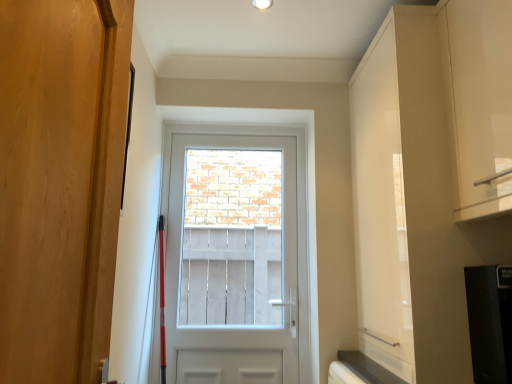
Question: Does wooden door at left, positioned as the 1th door in front-to-back order, have a lesser height compared to white glossy door at center, the first door from the back?

Choices:
 (A) yes
 (B) no

Answer: (A)

Question: Is wooden door at left, positioned as the 1th door in front-to-back order, to the right of white glossy door at center, the second door from the front, from the viewer's perspective?

Choices:
 (A) no
 (B) yes

Answer: (A)

Question: Does wooden door at left, the second door from the back, have a larger size compared to white glossy door at center, the first door from the back?

Choices:
 (A) no
 (B) yes

Answer: (A)

Question: Is wooden door at left, the second door from the back, positioned with its back to white glossy door at center, the second door from the front?

Choices:
 (A) no
 (B) yes

Answer: (A)

Question: Is wooden door at left, positioned as the 1th door in front-to-back order, outside white glossy door at center, the first door from the back?

Choices:
 (A) yes
 (B) no

Answer: (A)

Question: Looking at the image, does white glossy cabinet at upper right seem bigger or smaller compared to white wooden screen at center?

Choices:
 (A) big
 (B) small

Answer: (A)

Question: From the image's perspective, relative to white wooden screen at center, is white glossy cabinet at upper right above or below?

Choices:
 (A) below
 (B) above

Answer: (B)

Question: Considering their positions, is white glossy cabinet at upper right located in front of or behind white wooden screen at center?

Choices:
 (A) behind
 (B) front

Answer: (B)

Question: Would you say white glossy cabinet at upper right is to the left or to the right of white wooden screen at center in the picture?

Choices:
 (A) left
 (B) right

Answer: (B)

Question: Is point (472, 132) positioned closer to the camera than point (210, 122)?

Choices:
 (A) farther
 (B) closer

Answer: (B)

Question: Relative to white glossy door at center, the second door from the front, is white glossy cabinet at upper right in front or behind?

Choices:
 (A) front
 (B) behind

Answer: (A)

Question: Based on their sizes in the image, would you say white glossy cabinet at upper right is bigger or smaller than white glossy door at center, the second door from the front?

Choices:
 (A) big
 (B) small

Answer: (A)

Question: From the image's perspective, is white glossy cabinet at upper right located above or below white glossy door at center, the second door from the front?

Choices:
 (A) below
 (B) above

Answer: (B)

Question: Based on their sizes in the image, would you say white glossy door at center, the second door from the front, is bigger or smaller than white glossy cabinet at upper right?

Choices:
 (A) big
 (B) small

Answer: (B)

Question: Is white glossy door at center, the first door from the back, in front of or behind white glossy cabinet at upper right in the image?

Choices:
 (A) behind
 (B) front

Answer: (A)